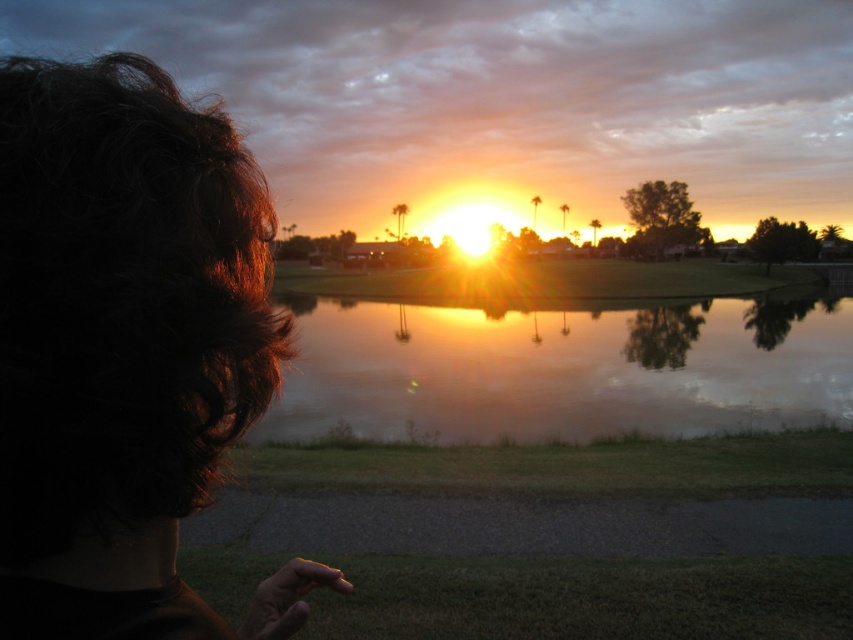
Between point (103, 189) and point (624, 362), which one is positioned in front?

Point (103, 189) is more forward.

Does dark brown hair at left appear under glistening reflective water at center?

Actually, dark brown hair at left is above glistening reflective water at center.

Between point (74, 576) and point (421, 348), which one is positioned behind?

The point (421, 348) is more distant.

Where is `dark brown hair at left`? dark brown hair at left is located at coordinates (126, 349).

Which is above, dark brown hair at left or green grassy golf course at center?

green grassy golf course at center is above.

Which is more to the right, dark brown hair at left or green grassy golf course at center?

Positioned to the right is green grassy golf course at center.

Between point (77, 444) and point (318, 289), which one is positioned behind?

Point (318, 289)

The image size is (853, 640). What are the coordinates of `dark brown hair at left` in the screenshot? It's located at (126, 349).

Where is `glistening reflective water at center`? The width and height of the screenshot is (853, 640). glistening reflective water at center is located at coordinates (561, 371).

Between glistening reflective water at center and green grassy golf course at center, which one has more height?

With more height is green grassy golf course at center.

Find the location of `glistening reflective water at center`. glistening reflective water at center is located at coordinates (561, 371).

This screenshot has width=853, height=640. I want to click on glistening reflective water at center, so click(561, 371).